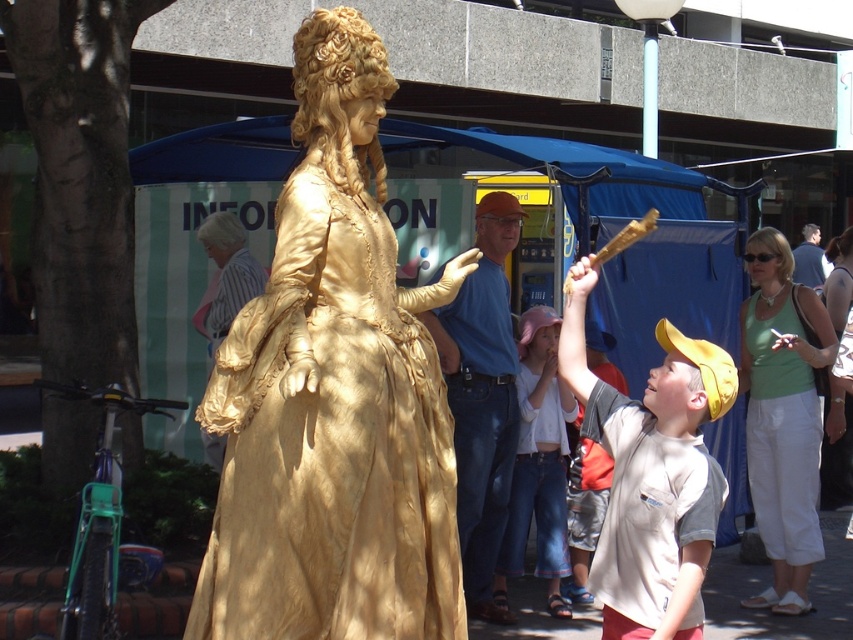
Question: Is matte green tank top at upper right further to the viewer compared to light brown leather jacket at upper right?

Choices:
 (A) yes
 (B) no

Answer: (B)

Question: Among these points, which one is farthest from the camera?

Choices:
 (A) click(x=819, y=240)
 (B) click(x=369, y=532)
 (C) click(x=651, y=618)
 (D) click(x=488, y=481)

Answer: (A)

Question: From the image, what is the correct spatial relationship of gold silk statue at center in relation to green fabric shirt at upper right?

Choices:
 (A) right
 (B) left

Answer: (B)

Question: Does blue denim jeans at center have a lesser width compared to matte green tank top at upper right?

Choices:
 (A) yes
 (B) no

Answer: (B)

Question: Which of these objects is positioned closest to the matte green tank top at upper right?

Choices:
 (A) blue denim jeans at center
 (B) gold silk statue at center
 (C) green fabric shirt at upper right

Answer: (C)

Question: Which point is closer to the camera?

Choices:
 (A) gold silk statue at center
 (B) light gray cotton shirt at center
 (C) green fabric shirt at upper right

Answer: (A)